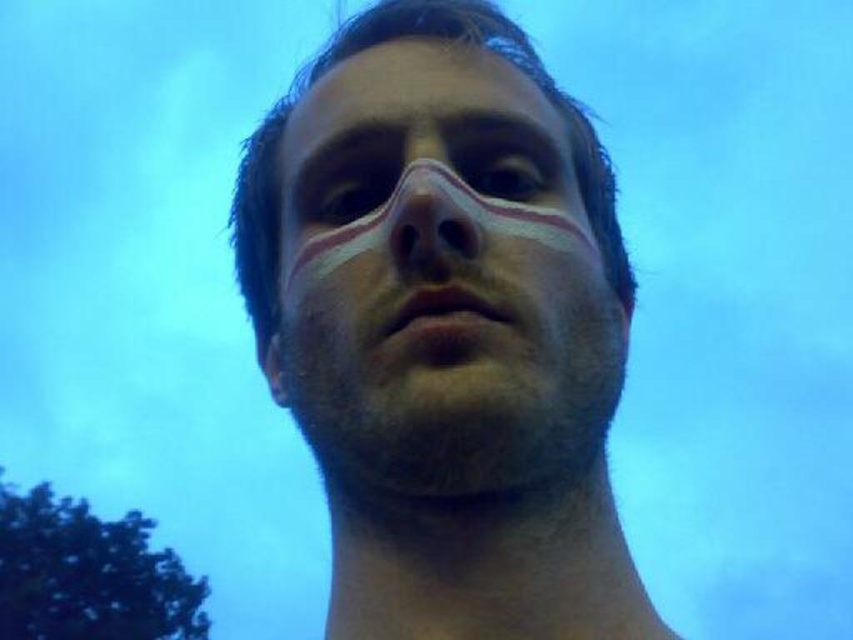
You are a photographer adjusting your camera settings to focus on the subject. Since the white matte face at center and the smooth skin nose at center are both in the frame, which one should you focus on to ensure the nose is sharp?

The white matte face at center is in front of the smooth skin nose at center, so focusing on the white matte face at center will ensure the nose is sharp as it is closer to the camera.

You are a photographer trying to align a subject in the center of the frame. The subject has a white matte forehead at center. Based on the coordinates provided, is the forehead positioned exactly at the center of the frame?

The white matte forehead at center is located at coordinates point [419,83], which does not align with the exact center of the frame. The exact center would be at coordinates [426,320]. Therefore, the forehead is positioned to the left and slightly below the true center of the frame.